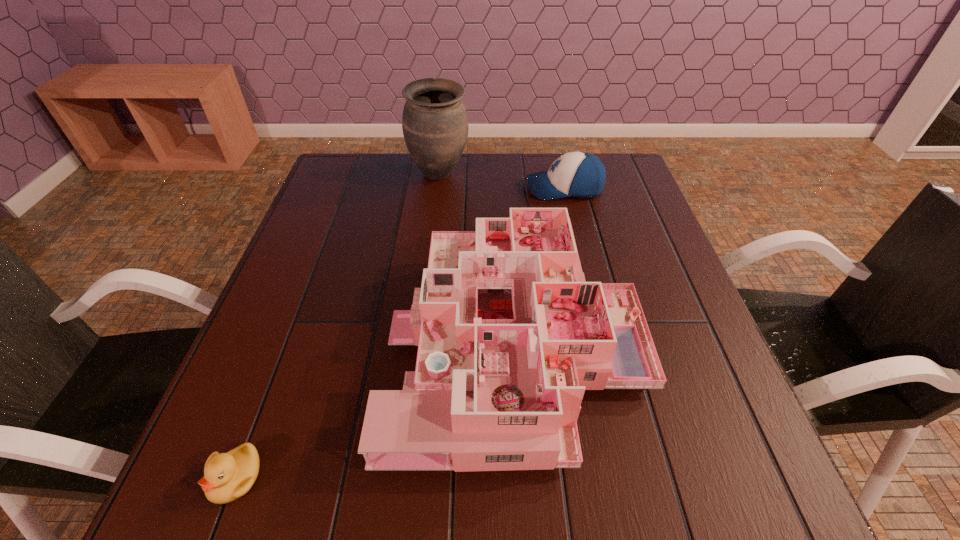
Identify the location of object that is positioned at the near right corner. (510, 335).

The width and height of the screenshot is (960, 540). In the image, there is a desktop. Identify the location of free region at the far edge. (393, 156).

This screenshot has height=540, width=960. What are the coordinates of `vacant space at the near edge of the desktop` in the screenshot? It's located at (315, 509).

Find the location of a particular element. The image size is (960, 540). vacant space at the left edge is located at coordinates (270, 412).

Image resolution: width=960 pixels, height=540 pixels. Identify the location of vacant space at the right edge of the desktop. (650, 255).

In the image, there is a desktop. Where is `vacant space at the far left corner`? This screenshot has height=540, width=960. vacant space at the far left corner is located at coordinates (374, 180).

You are a GUI agent. You are given a task and a screenshot of the screen. Output one action in this format:
    pyautogui.click(x=<x>, y=<y>)
    Task: Click on the vacant area that lies between the urn and the shortest object
    The image size is (960, 540).
    Given the screenshot: What is the action you would take?
    pyautogui.click(x=338, y=326)

This screenshot has width=960, height=540. Find the location of `free space between the baseball cap and the urn`. free space between the baseball cap and the urn is located at coordinates (502, 181).

At what (x,y) coordinates should I click in order to perform the action: click on empty location between the urn and the third tallest object. Please return your answer as a coordinate pair (x, y). Looking at the image, I should click on (502, 181).

Point out which object is positioned as the third nearest to the tallest object. Please provide its 2D coordinates. Your answer should be formatted as a tuple, i.e. [(x, y)], where the tuple contains the x and y coordinates of a point satisfying the conditions above.

[(227, 476)]